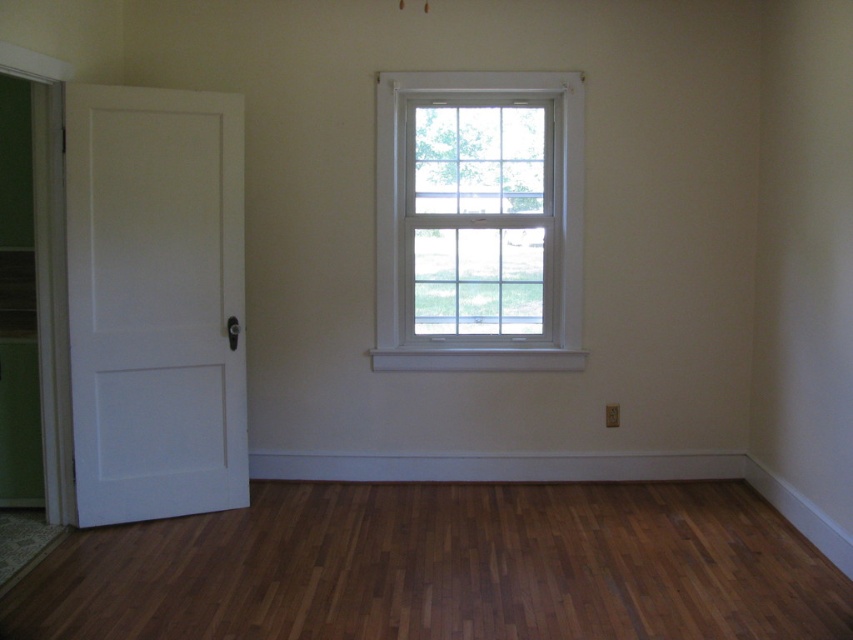
Question: Which is nearer to the white matte door at left?

Choices:
 (A) white wood window at center
 (B) shiny brown hardwood floor at lower center

Answer: (A)

Question: Among these points, which one is farthest from the camera?

Choices:
 (A) (213, 401)
 (B) (502, 321)
 (C) (434, 628)

Answer: (B)

Question: Observing the image, what is the correct spatial positioning of shiny brown hardwood floor at lower center in reference to white matte door at left?

Choices:
 (A) right
 (B) left

Answer: (A)

Question: Does shiny brown hardwood floor at lower center lie in front of white wood window at center?

Choices:
 (A) no
 (B) yes

Answer: (B)

Question: Which object is positioned closest to the shiny brown hardwood floor at lower center?

Choices:
 (A) white wood window at center
 (B) white matte door at left

Answer: (B)

Question: Observing the image, what is the correct spatial positioning of shiny brown hardwood floor at lower center in reference to white matte door at left?

Choices:
 (A) right
 (B) left

Answer: (A)